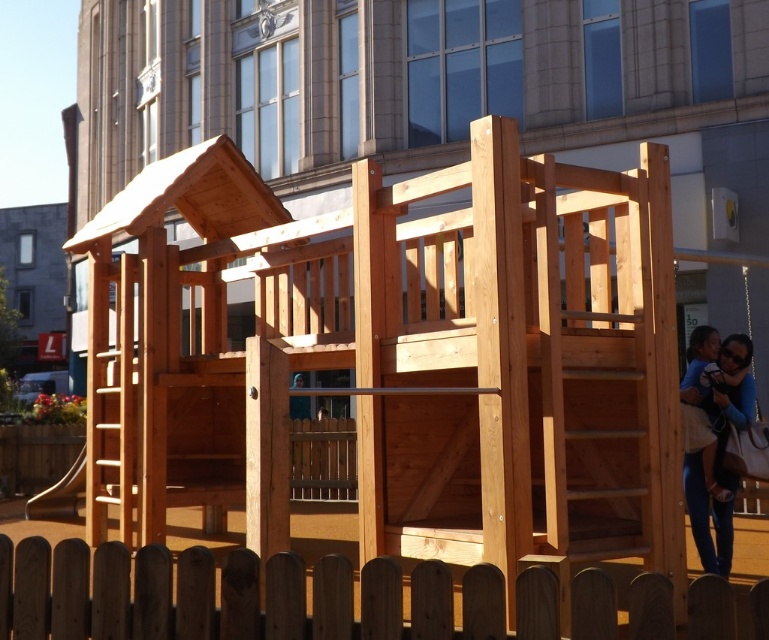
Looking at this image, you are standing at the entrance of the playground and see the brown wooden fence at lower center and the brown wooden fence at center. Which fence is closer to your right side?

The brown wooden fence at lower center is to the right of brown wooden fence at center, so the brown wooden fence at lower center is closer to your right side.

You are a parent supervising children at the playground. You see the brown wooden fence at lower center and the smooth brown slide at lower left. Which object is closer to the left side of the image?

The smooth brown slide at lower left is closer to the left side of the image because it is positioned to the left of the brown wooden fence at lower center.

You are a parent supervising children at the playground. You notice the brown wooden fence at lower center and the smooth brown slide at lower left. From your vantage point, which object is positioned higher in the image?

The brown wooden fence at lower center is positioned above the smooth brown slide at lower left, so it is higher in the image.